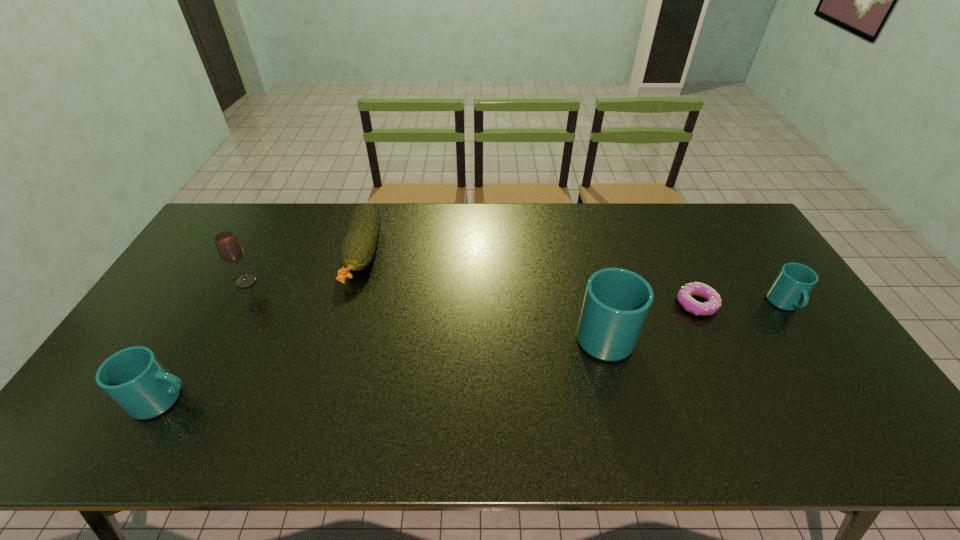
You are a GUI agent. You are given a task and a screenshot of the screen. Output one action in this format:
    pyautogui.click(x=<x>, y=<y>)
    Task: Click on the vacant spot for a new cup to ensure equal spacing
    
    Given the screenshot: What is the action you would take?
    pyautogui.click(x=397, y=363)